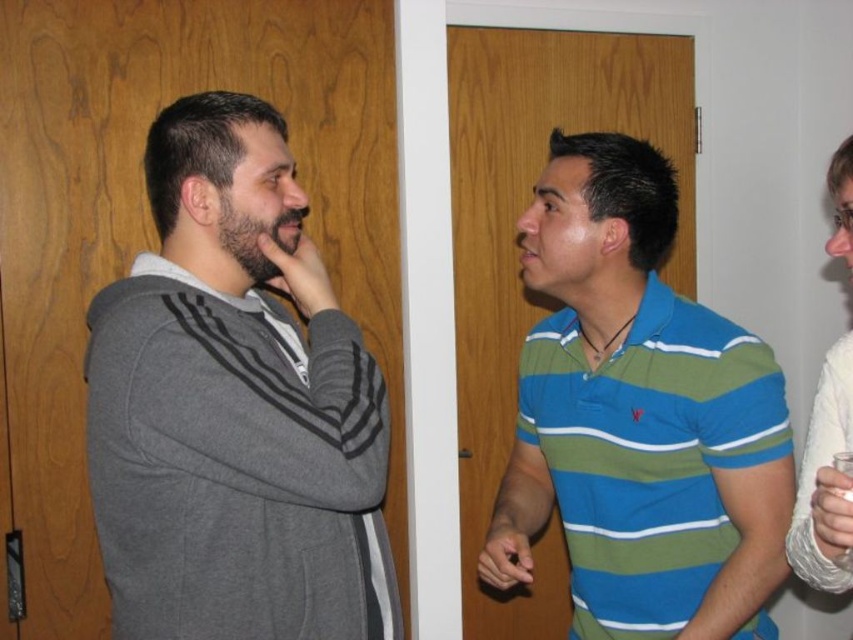
Question: Does gray fleece jacket at left appear under white textured fabric at right?

Choices:
 (A) yes
 (B) no

Answer: (A)

Question: Among these objects, which one is farthest from the camera?

Choices:
 (A) white textured fabric at right
 (B) striped cotton polo shirt at center

Answer: (B)

Question: Which is farther from the gray fleece jacket at left?

Choices:
 (A) striped cotton polo shirt at center
 (B) white textured fabric at right

Answer: (B)

Question: Among these points, which one is nearest to the camera?

Choices:
 (A) (743, 588)
 (B) (132, 480)

Answer: (B)

Question: Is gray fleece jacket at left thinner than white textured fabric at right?

Choices:
 (A) yes
 (B) no

Answer: (B)

Question: Can you confirm if striped cotton polo shirt at center is positioned to the right of white textured fabric at right?

Choices:
 (A) yes
 (B) no

Answer: (B)